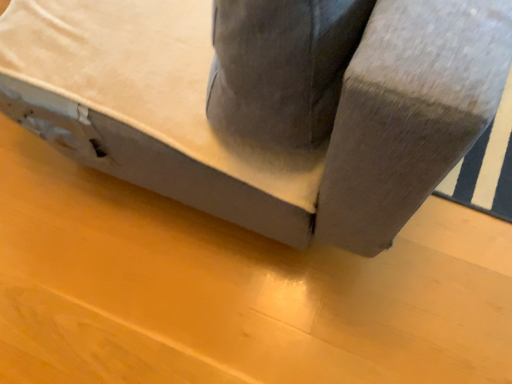
The width and height of the screenshot is (512, 384). What do you see at coordinates (233, 290) in the screenshot?
I see `matte gray plywood at lower center` at bounding box center [233, 290].

Where is `matte gray plywood at lower center`? matte gray plywood at lower center is located at coordinates (233, 290).

What is the approximate width of matte gray plywood at lower center?

The width of matte gray plywood at lower center is 6.36 feet.

Measure the distance between matte gray plywood at lower center and camera.

matte gray plywood at lower center is 3.30 feet away from camera.

Image resolution: width=512 pixels, height=384 pixels. What do you see at coordinates (264, 106) in the screenshot?
I see `suede gray couch at center` at bounding box center [264, 106].

Where is `suede gray couch at center`? This screenshot has height=384, width=512. suede gray couch at center is located at coordinates (264, 106).

At what (x,y) coordinates should I click in order to perform the action: click on matte gray plywood at lower center. Please return your answer as a coordinate pair (x, y). Looking at the image, I should click on (233, 290).

Does suede gray couch at center appear on the right side of matte gray plywood at lower center?

Yes.

Is suede gray couch at center in front of or behind matte gray plywood at lower center in the image?

suede gray couch at center is positioned closer to the viewer than matte gray plywood at lower center.

Considering the positions of point (133, 145) and point (92, 214), is point (133, 145) closer or farther from the camera than point (92, 214)?

Point (133, 145) is positioned closer to the camera compared to point (92, 214).

From the image's perspective, is suede gray couch at center located beneath matte gray plywood at lower center?

No, from the image's perspective, suede gray couch at center is not beneath matte gray plywood at lower center.

In the scene shown: From a real-world perspective, is suede gray couch at center positioned above or below matte gray plywood at lower center?

suede gray couch at center is above matte gray plywood at lower center.

Based on the photo, does suede gray couch at center have a greater width compared to matte gray plywood at lower center?

In fact, suede gray couch at center might be narrower than matte gray plywood at lower center.

Which of these two, suede gray couch at center or matte gray plywood at lower center, stands taller?

Standing taller between the two is suede gray couch at center.

Based on their sizes in the image, would you say suede gray couch at center is bigger or smaller than matte gray plywood at lower center?

In the image, suede gray couch at center appears to be larger than matte gray plywood at lower center.

Is suede gray couch at center outside of matte gray plywood at lower center?

Yes.

Is suede gray couch at center not close to matte gray plywood at lower center?

No, there isn't a large distance between suede gray couch at center and matte gray plywood at lower center.

Is suede gray couch at center facing towards matte gray plywood at lower center?

No.

Locate an element on the screen. Image resolution: width=512 pixels, height=384 pixels. furniture on the right of the matte gray plywood at lower center is located at coordinates (264, 106).

Is matte gray plywood at lower center to the right of suede gray couch at center from the viewer's perspective?

In fact, matte gray plywood at lower center is to the left of suede gray couch at center.

Which object is further away from the camera taking this photo, matte gray plywood at lower center or suede gray couch at center?

matte gray plywood at lower center.

Is point (147, 370) closer or farther from the camera than point (502, 81)?

Point (147, 370).

From the image's perspective, is matte gray plywood at lower center under suede gray couch at center?

Yes.

From a real-world perspective, is matte gray plywood at lower center physically below suede gray couch at center?

Correct, in the physical world, matte gray plywood at lower center is lower than suede gray couch at center.

Does matte gray plywood at lower center have a greater width compared to suede gray couch at center?

Correct, the width of matte gray plywood at lower center exceeds that of suede gray couch at center.

Is matte gray plywood at lower center shorter than suede gray couch at center?

Correct, matte gray plywood at lower center is not as tall as suede gray couch at center.

Is matte gray plywood at lower center smaller than suede gray couch at center?

Indeed, matte gray plywood at lower center has a smaller size compared to suede gray couch at center.

Is matte gray plywood at lower center situated inside suede gray couch at center or outside?

matte gray plywood at lower center is outside suede gray couch at center.

Would you consider matte gray plywood at lower center to be distant from suede gray couch at center?

matte gray plywood at lower center is near suede gray couch at center, not far away.

Is matte gray plywood at lower center looking in the opposite direction of suede gray couch at center?

matte gray plywood at lower center does not have its back to suede gray couch at center.

What's the angular difference between matte gray plywood at lower center and suede gray couch at center's facing directions?

The angle between the facing direction of matte gray plywood at lower center and the facing direction of suede gray couch at center is 0.787 degrees.

Measure the distance from matte gray plywood at lower center to suede gray couch at center.

41.91 centimeters.

The image size is (512, 384). Identify the location of plywood located on the left of suede gray couch at center. (233, 290).

What are the coordinates of `plywood directly beneath the suede gray couch at center (from a real-world perspective)` in the screenshot? It's located at (233, 290).

Image resolution: width=512 pixels, height=384 pixels. In order to click on plywood on the left of the suede gray couch at center in this screenshot , I will do `click(233, 290)`.